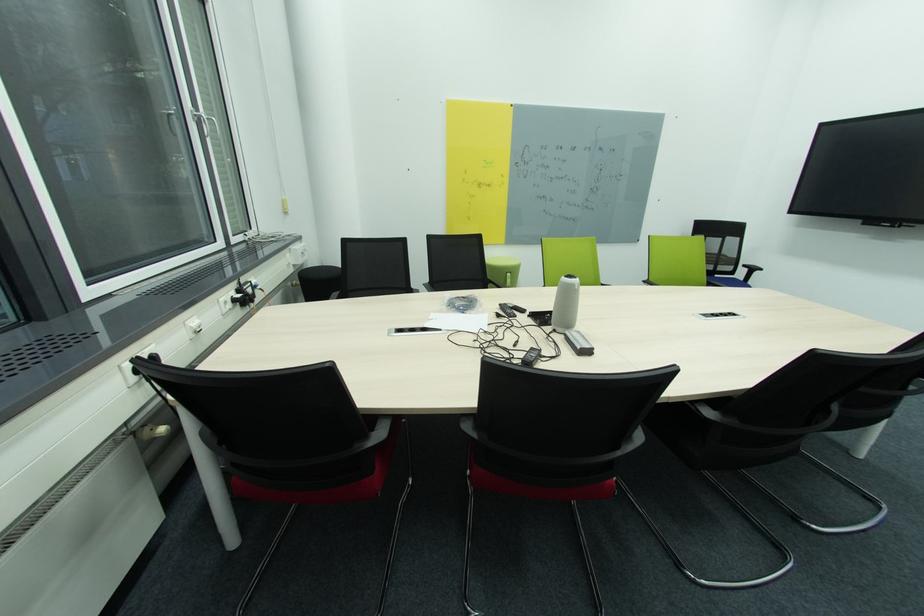
The location [457,321] corresponds to which object?

This point indicates the white paper sheet.